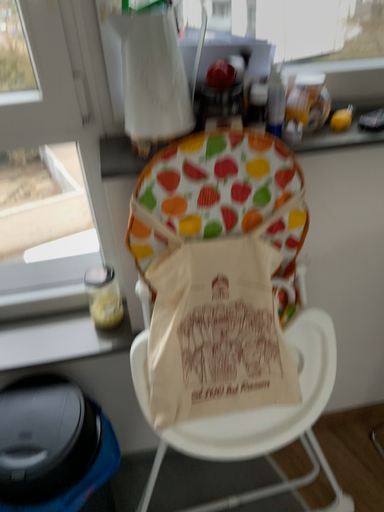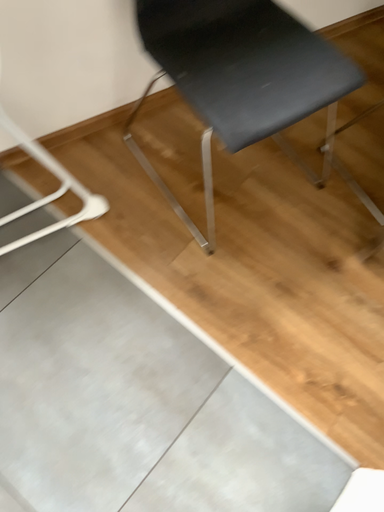
Question: How did the camera likely rotate when shooting the video?

Choices:
 (A) rotated left
 (B) rotated right

Answer: (B)